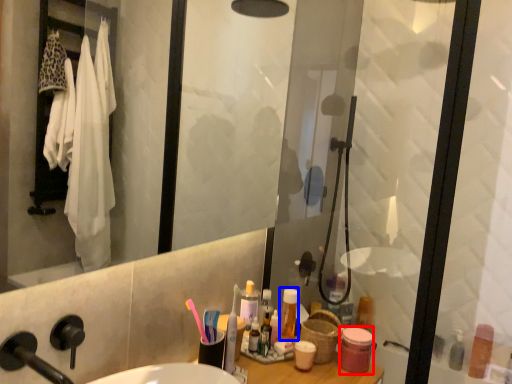
Question: Which object appears closest to the camera in this image, toiletry (highlighted by a red box) or toiletry (highlighted by a blue box)?

Choices:
 (A) toiletry
 (B) toiletry

Answer: (A)